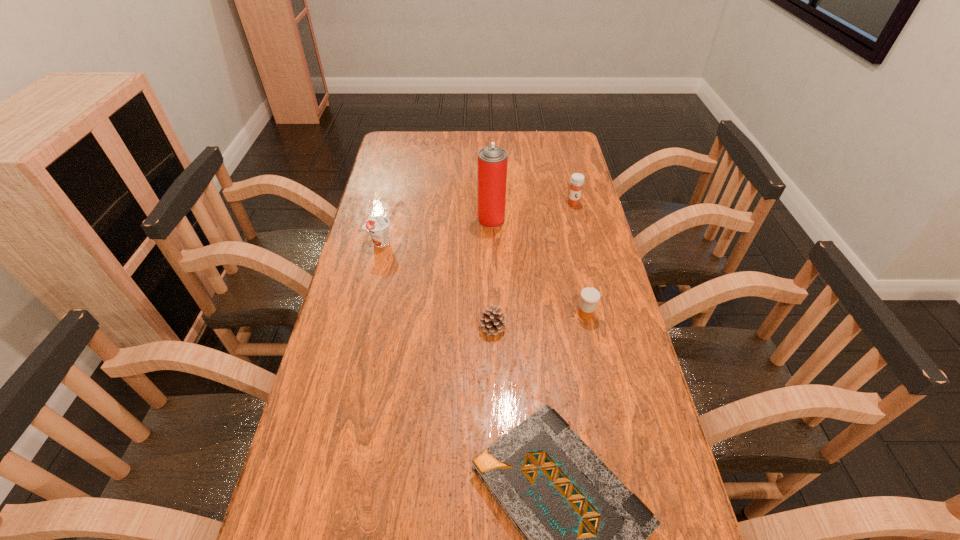
Locate an element on the screen. The width and height of the screenshot is (960, 540). vacant point located on the front of the leftmost object is located at coordinates (355, 349).

Locate an element on the screen. This screenshot has height=540, width=960. free space located 0.080m on the label of the nearer medicine is located at coordinates (592, 345).

This screenshot has height=540, width=960. I want to click on blank space located on the front of the pinecone, so click(495, 441).

The height and width of the screenshot is (540, 960). In order to click on object that is at the left edge in this screenshot , I will do [x=378, y=226].

Where is `free region at the far edge of the desktop`? free region at the far edge of the desktop is located at coordinates (449, 152).

In the image, there is a desktop. Where is `vacant region at the left edge`? The width and height of the screenshot is (960, 540). vacant region at the left edge is located at coordinates (378, 210).

This screenshot has height=540, width=960. In the image, there is a desktop. In order to click on vacant region at the right edge in this screenshot , I will do `click(548, 166)`.

In the image, there is a desktop. Where is `vacant space at the far right corner`? Image resolution: width=960 pixels, height=540 pixels. vacant space at the far right corner is located at coordinates (551, 155).

In order to click on vacant area between the pinecone and the farther medicine in this screenshot , I will do `click(533, 265)`.

Locate an element on the screen. The width and height of the screenshot is (960, 540). vacant area that lies between the third farthest object and the second farthest object is located at coordinates (436, 231).